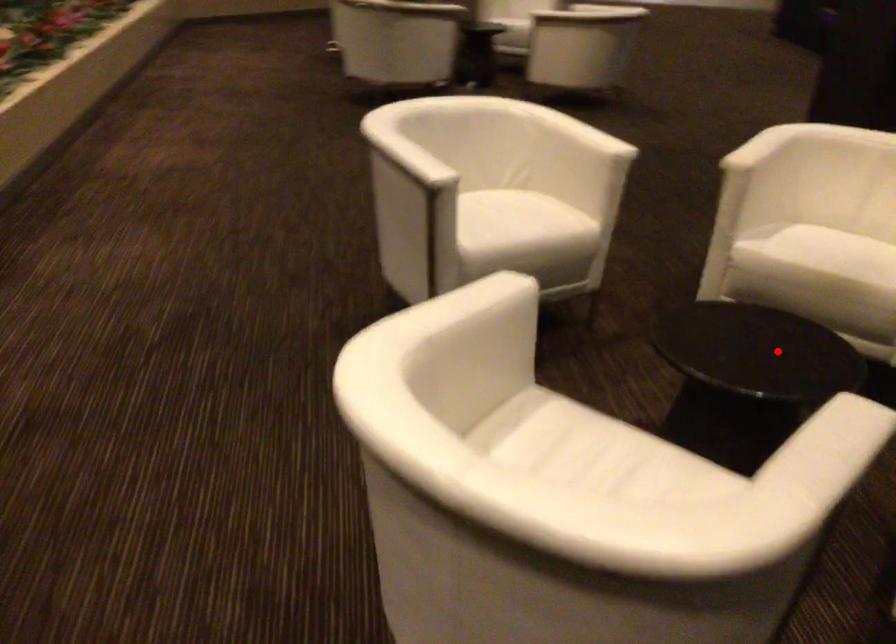
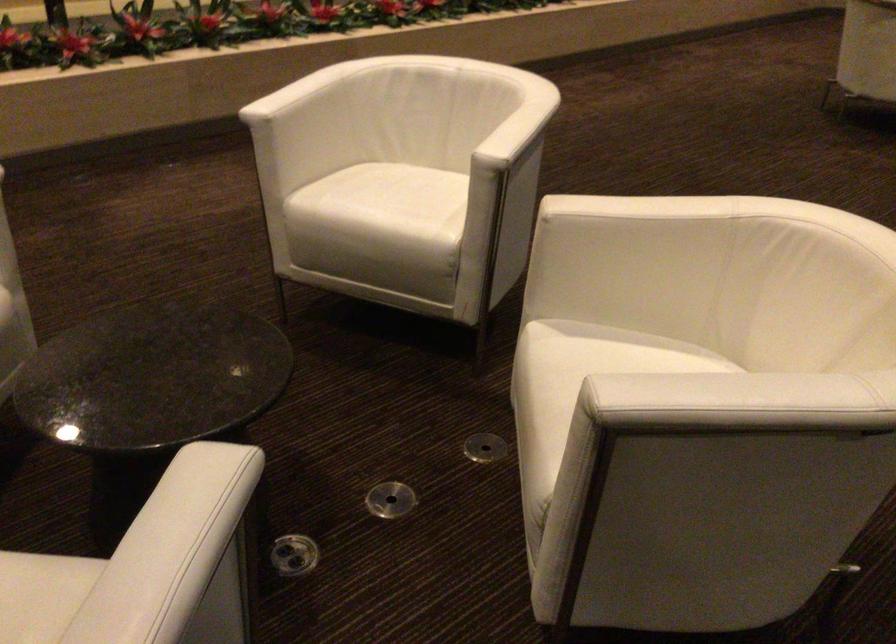
Locate, in the second image, the point that corresponds to the highlighted location in the first image.

(152, 377)